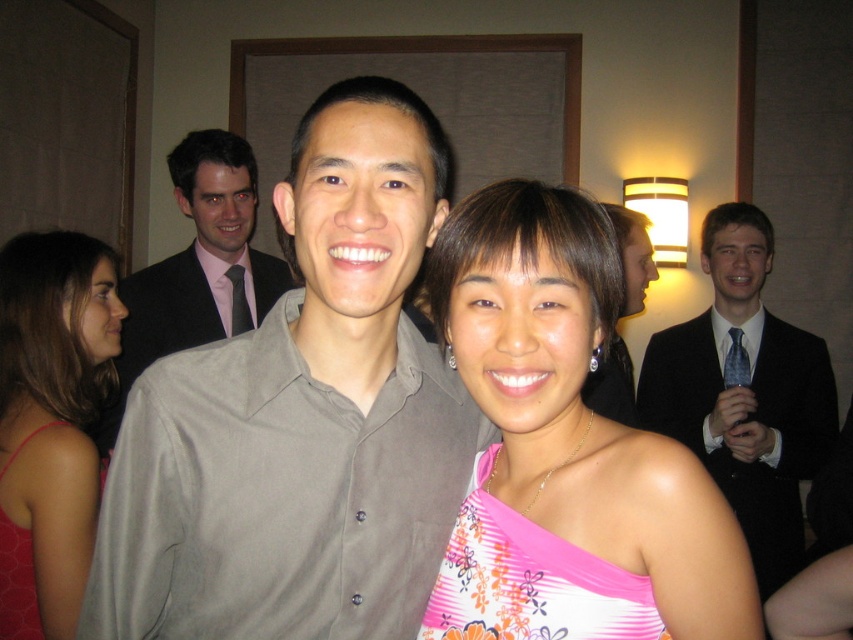
You are at a formal event and see two dresses in the image. The red fabric dress at left and the floral print fabric dress at center. Which dress is positioned more to the left side of the image?

The red fabric dress at left is positioned more to the left side of the image because it is to the left of the floral print fabric dress at center.

You are at a party and want to find the pink floral dress at center. Which direction should you look relative to the red satin dress at lower left?

The pink floral dress at center is to the right of the red satin dress at lower left, so you should look to the right side from the red satin dress at lower left to find it.